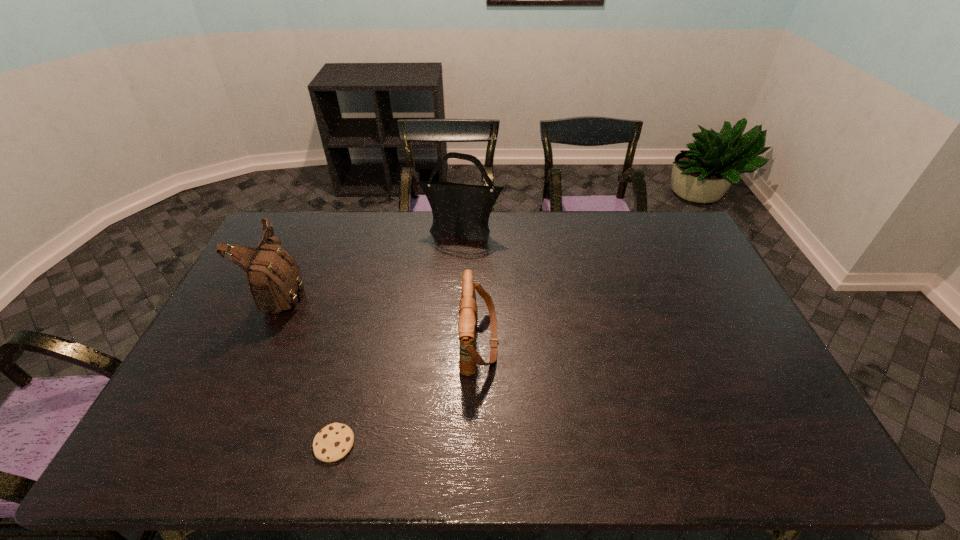
The image size is (960, 540). What are the coordinates of `vacant space situated 0.370m on the right of the nearest object` in the screenshot? It's located at (508, 444).

Find the location of a particular element. object that is at the far edge is located at coordinates (460, 209).

This screenshot has width=960, height=540. I want to click on object that is at the near edge, so [332, 443].

I want to click on object present at the left edge, so click(274, 279).

At what (x,y) coordinates should I click in order to perform the action: click on blank area at the far edge. Please return your answer as a coordinate pair (x, y). Looking at the image, I should click on (308, 249).

The width and height of the screenshot is (960, 540). In the image, there is a desktop. Find the location of `vacant area at the left edge`. vacant area at the left edge is located at coordinates (256, 334).

This screenshot has height=540, width=960. In the image, there is a desktop. Find the location of `free space at the right edge`. free space at the right edge is located at coordinates (771, 382).

Image resolution: width=960 pixels, height=540 pixels. Find the location of `vacant region at the far left corner of the desktop`. vacant region at the far left corner of the desktop is located at coordinates [306, 242].

You are a GUI agent. You are given a task and a screenshot of the screen. Output one action in this format:
    pyautogui.click(x=<x>, y=<y>)
    Task: Click on the vacant position at the near right corner of the desktop
    The image size is (960, 540).
    Given the screenshot: What is the action you would take?
    pyautogui.click(x=791, y=451)

You are a GUI agent. You are given a task and a screenshot of the screen. Output one action in this format:
    pyautogui.click(x=<x>, y=<y>)
    Task: Click on the blank region between the farthest shoulder bag and the shortest object
    This screenshot has width=960, height=540.
    Given the screenshot: What is the action you would take?
    pyautogui.click(x=398, y=338)